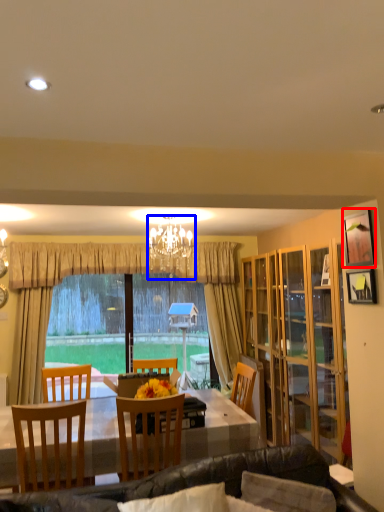
Question: Which point is further to the camera, picture frame (highlighted by a red box) or lamp (highlighted by a blue box)?

Choices:
 (A) picture frame
 (B) lamp

Answer: (B)